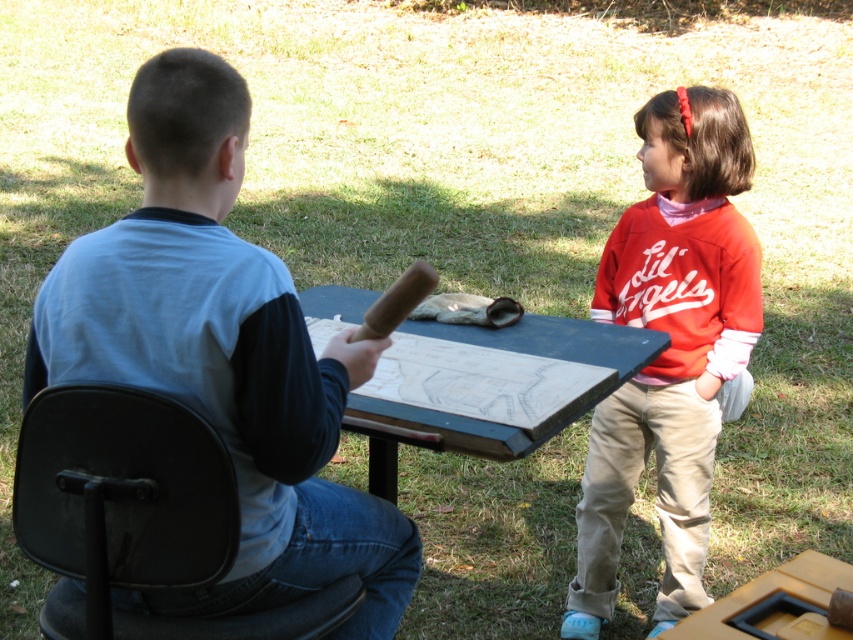
Question: Does black leather chair at left appear on the right side of yellow matte picnic table at lower right?

Choices:
 (A) yes
 (B) no

Answer: (B)

Question: Which point is farther to the camera?

Choices:
 (A) brown wooden baseball bat at center
 (B) wooden picnic table at center
 (C) black leather chair at left
 (D) light blue cotton shirt at center

Answer: (B)

Question: Is black leather chair at left bigger than brown wooden baseball bat at center?

Choices:
 (A) yes
 (B) no

Answer: (A)

Question: Which point appears farthest from the camera in this image?

Choices:
 (A) (207, 609)
 (B) (821, 628)
 (C) (91, 420)

Answer: (A)

Question: Where is wooden picnic table at center located in relation to brown wooden baseball bat at center in the image?

Choices:
 (A) left
 (B) right

Answer: (B)

Question: Which object is closer to the camera taking this photo?

Choices:
 (A) wooden picnic table at center
 (B) light blue cotton shirt at center
 (C) yellow matte picnic table at lower right
 (D) matte red sweatshirt at right

Answer: (B)